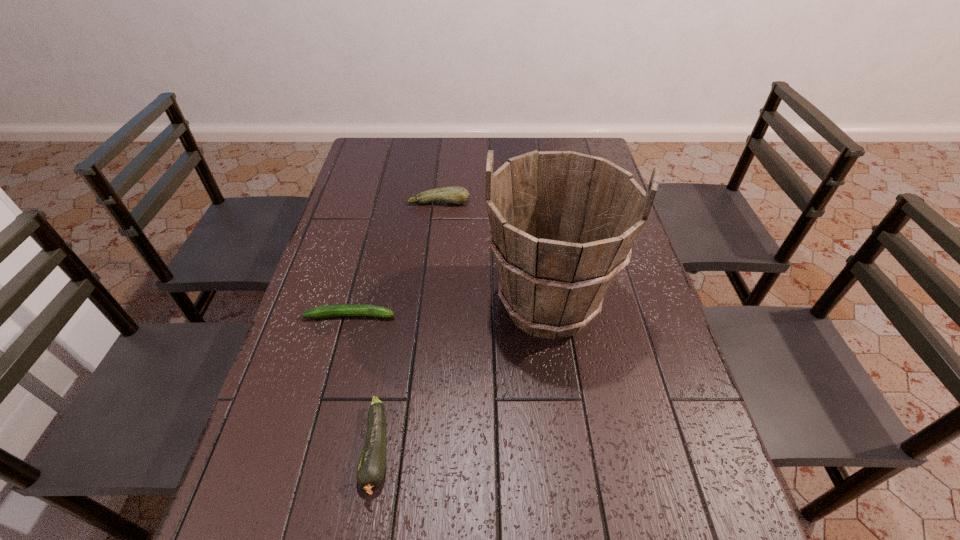
Where is `vacant space that's between the rightmost object and the nearest zucchini`? The height and width of the screenshot is (540, 960). vacant space that's between the rightmost object and the nearest zucchini is located at coordinates (463, 377).

You are a GUI agent. You are given a task and a screenshot of the screen. Output one action in this format:
    pyautogui.click(x=<x>, y=<y>)
    Task: Click on the empty space that is in between the farthest object and the nearest object
    This screenshot has width=960, height=540.
    Given the screenshot: What is the action you would take?
    pyautogui.click(x=408, y=326)

The width and height of the screenshot is (960, 540). I want to click on vacant point located between the shortest object and the rightmost object, so point(449,310).

Find the location of a particular element. unoccupied position between the shortest object and the nearest object is located at coordinates (364, 383).

In order to click on object that is the closest to the nearest zucchini in this screenshot , I will do `click(562, 224)`.

Locate an element on the screen. object that is the third closest to the nearest zucchini is located at coordinates (454, 194).

Choose which zucchini is the nearest neighbor to the nearest zucchini. Please provide its 2D coordinates. Your answer should be formatted as a tuple, i.e. [(x, y)], where the tuple contains the x and y coordinates of a point satisfying the conditions above.

[(345, 309)]

At what (x,y) coordinates should I click in order to perform the action: click on zucchini object that ranks as the second closest to the farthest zucchini. Please return your answer as a coordinate pair (x, y). The image size is (960, 540). Looking at the image, I should click on (371, 468).

What are the coordinates of `free location that satisfies the following two spatial constraints: 1. at the stem end of the farthest zucchini; 2. on the front-facing side of the second farthest zucchini` in the screenshot? It's located at (427, 315).

In order to click on vacant area that satisfies the following two spatial constraints: 1. at the stem end of the farthest zucchini; 2. on the right side of the rightmost object in this screenshot , I will do `click(428, 305)`.